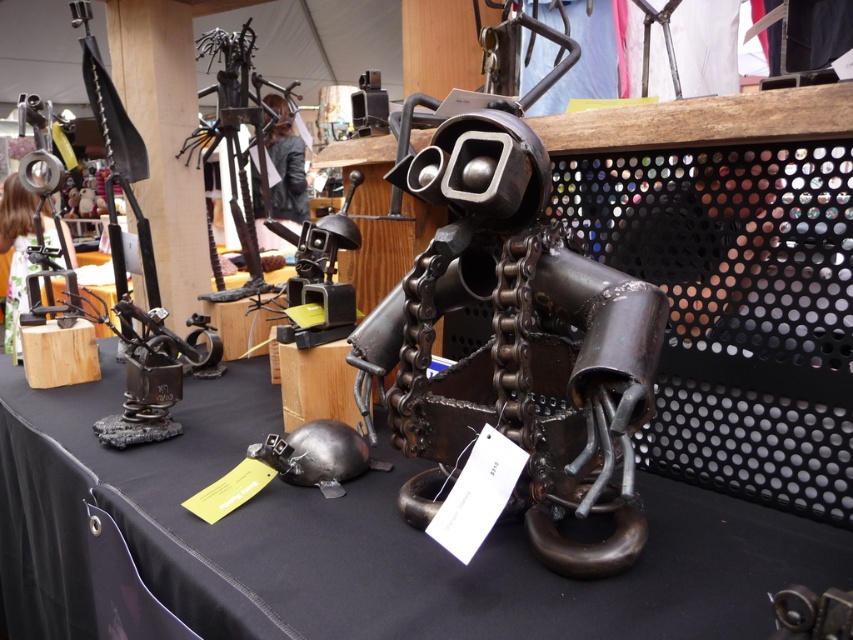
You are a customer at the outdoor market looking at the sculptures. You want to take a photo of the black matte tablecloth at center without any obstructions. Is the metallic chain at center blocking your view of it?

The black matte tablecloth at center is in front of the metallic chain at center, so the metallic chain at center is behind it and not blocking the view.

Consider the image. You are an art curator examining the metal sculptures displayed on the black table. You notice a specific point at coordinates (349, 538). What object is located at this point?

The black matte tablecloth at center is located at point (349, 538).